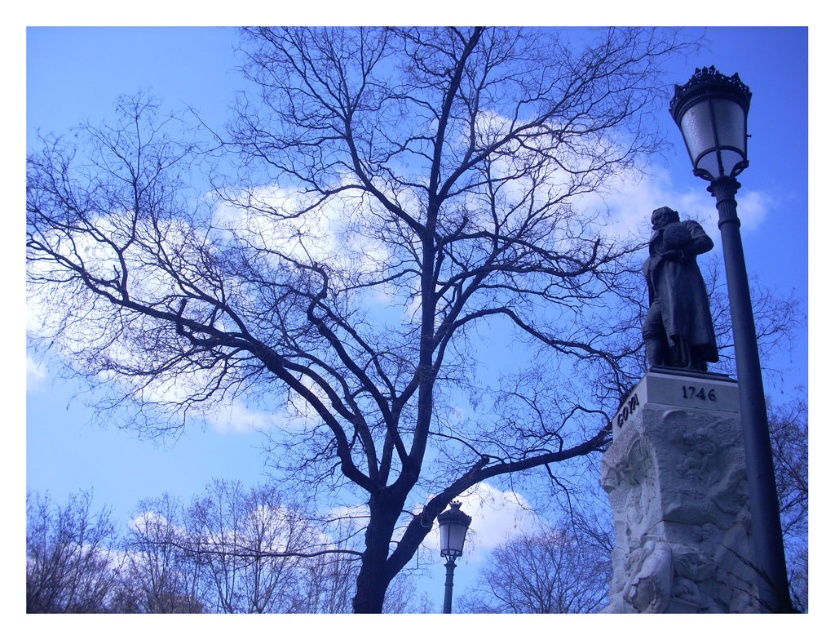
You are standing in the outdoor scene with the large leafless tree and the statue on its pedestal. You notice a point in the distance at coordinates point (x=489, y=582). If you want to walk towards this point, will you have enough space to move freely? Please explain your reasoning.

The point (x=489, y=582) is 105.30 meters away from the viewer. Since this distance is quite large, there is ample space for you to move freely towards it without any obstructions.

You are standing in the park and see the polished brass street light at right and the bronze statue at upper right. Which object is nearer to you?

The polished brass street light at right is closer to the viewer than the bronze statue at upper right.

You are a bird looking for a place to perch. You see the bare branches at center and the bare branches at lower left. Which branches are located above the other?

The bare branches at center are positioned over the bare branches at lower left, so they are above.